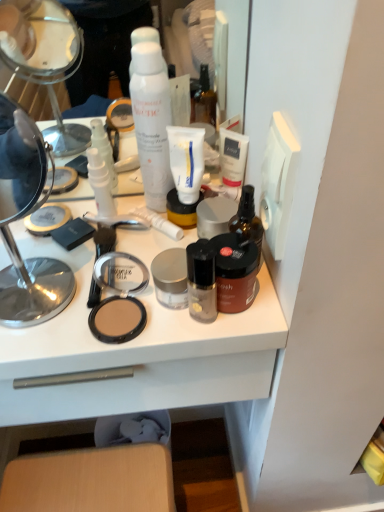
In order to click on vacant space to the left of satin black foundation at center, the fourth toiletry from the left in this screenshot , I will do `click(83, 311)`.